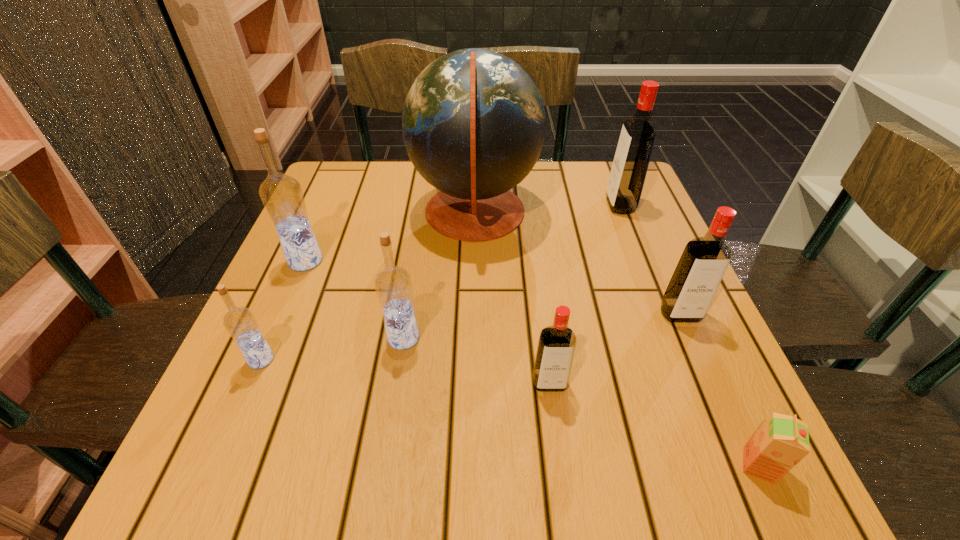
At what (x,y) coordinates should I click in order to perform the action: click on vacant region at the far edge of the desktop. Please return your answer as a coordinate pair (x, y). The width and height of the screenshot is (960, 540). Looking at the image, I should click on (574, 176).

This screenshot has width=960, height=540. Identify the location of vacant space at the near edge. (474, 437).

In order to click on vacant point at the left edge in this screenshot , I will do 298,285.

I want to click on vacant region at the right edge, so click(685, 334).

The height and width of the screenshot is (540, 960). Identify the location of vacant space at the far left corner of the desktop. (350, 176).

Locate an element on the screen. vacant space at the near left corner of the desktop is located at coordinates (268, 471).

At what (x,y) coordinates should I click in order to perform the action: click on blank region between the smallest red vodka and the rightmost blue vodka. Please return your answer as a coordinate pair (x, y). Looking at the image, I should click on (476, 360).

You are a GUI agent. You are given a task and a screenshot of the screen. Output one action in this format:
    pyautogui.click(x=<x>, y=<y>)
    Task: Click on the empty location between the rightmost blue vodka and the nearest red vodka
    The height and width of the screenshot is (540, 960).
    Given the screenshot: What is the action you would take?
    pyautogui.click(x=476, y=360)

Locate an element on the screen. The height and width of the screenshot is (540, 960). vacant space that's between the fourth vodka from left to right and the nearest object is located at coordinates pyautogui.click(x=654, y=424).

The width and height of the screenshot is (960, 540). I want to click on vacant point located between the globe and the third vodka from left to right, so click(439, 276).